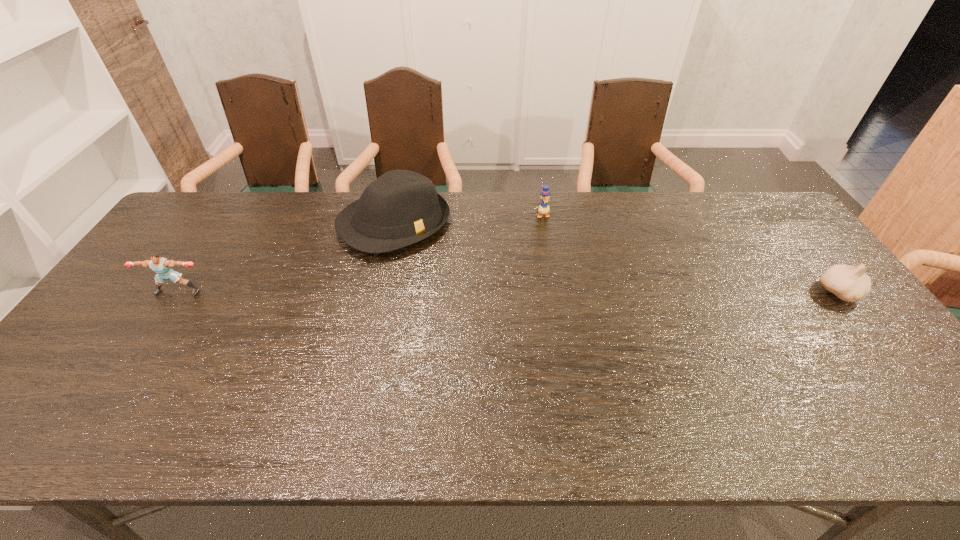
I want to click on vacant space on the desktop that is between the leftmost object and the rightmost object and is positioned on the face of the duckling, where the monocle is placed, so click(x=570, y=292).

Locate an element on the screen. This screenshot has width=960, height=540. free space on the desktop that is between the leftmost object and the rightmost object and is positioned on the front-facing side of the fedora is located at coordinates (469, 292).